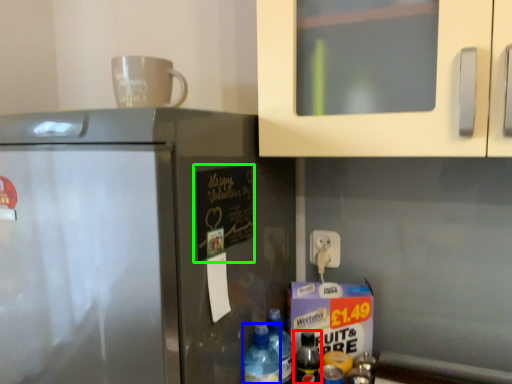
Question: Estimate the real-world distances between objects in this image. Which object is farther from bottle (highlighted by a red box), bottle (highlighted by a blue box) or bulletin board (highlighted by a green box)?

Choices:
 (A) bottle
 (B) bulletin board

Answer: (B)